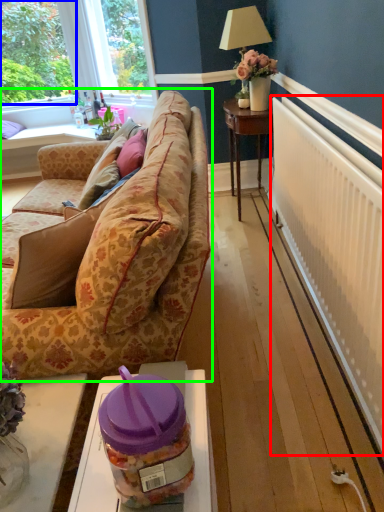
Question: Estimate the real-world distances between objects in this image. Which object is farther from radiator (highlighted by a red box), plant (highlighted by a blue box) or studio couch (highlighted by a green box)?

Choices:
 (A) plant
 (B) studio couch

Answer: (A)